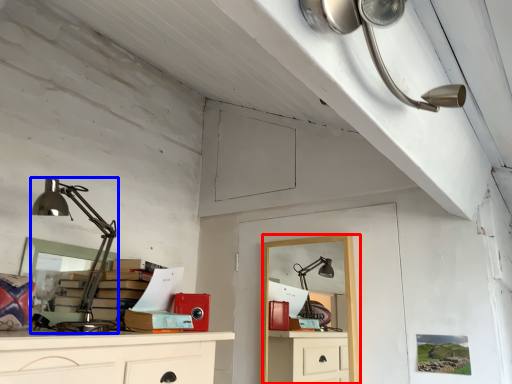
Question: Which object is further to the camera taking this photo, computer desk (highlighted by a red box) or lamp (highlighted by a blue box)?

Choices:
 (A) computer desk
 (B) lamp

Answer: (A)